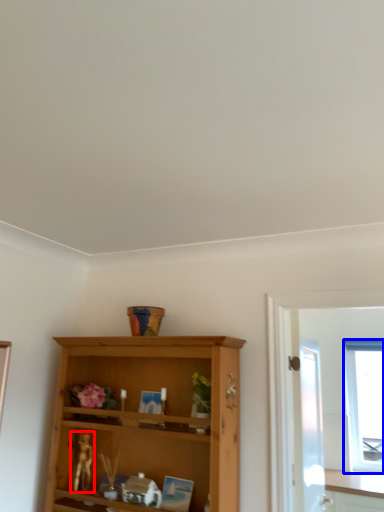
Question: Which object is closer to the camera taking this photo, miniature (highlighted by a red box) or window (highlighted by a blue box)?

Choices:
 (A) miniature
 (B) window

Answer: (A)